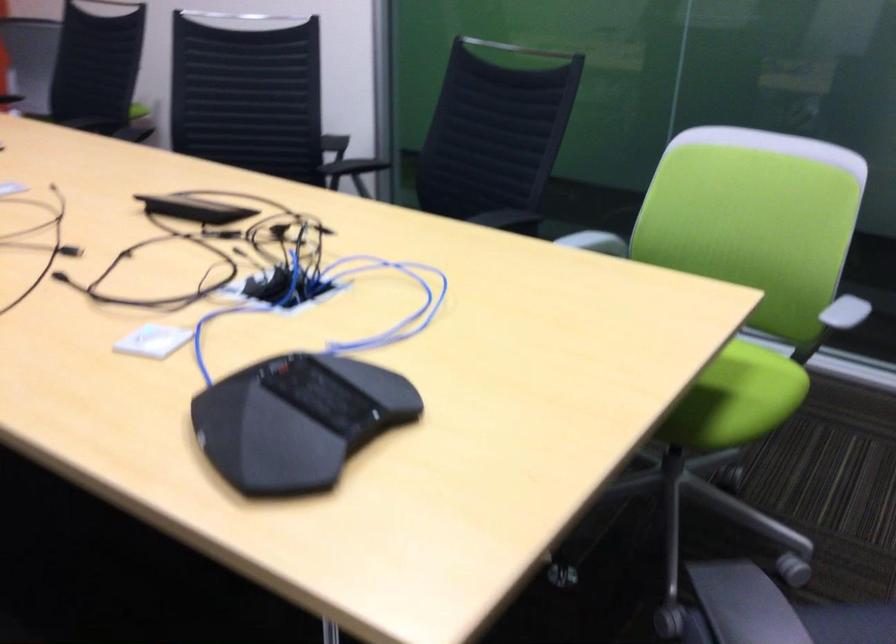
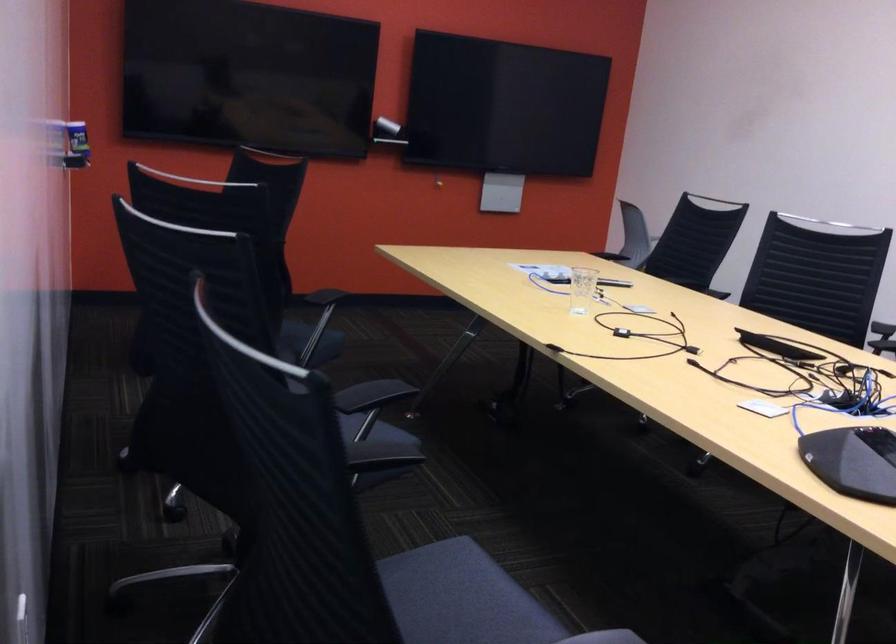
Locate, in the second image, the point that corresponds to [264,424] in the first image.

(853, 460)